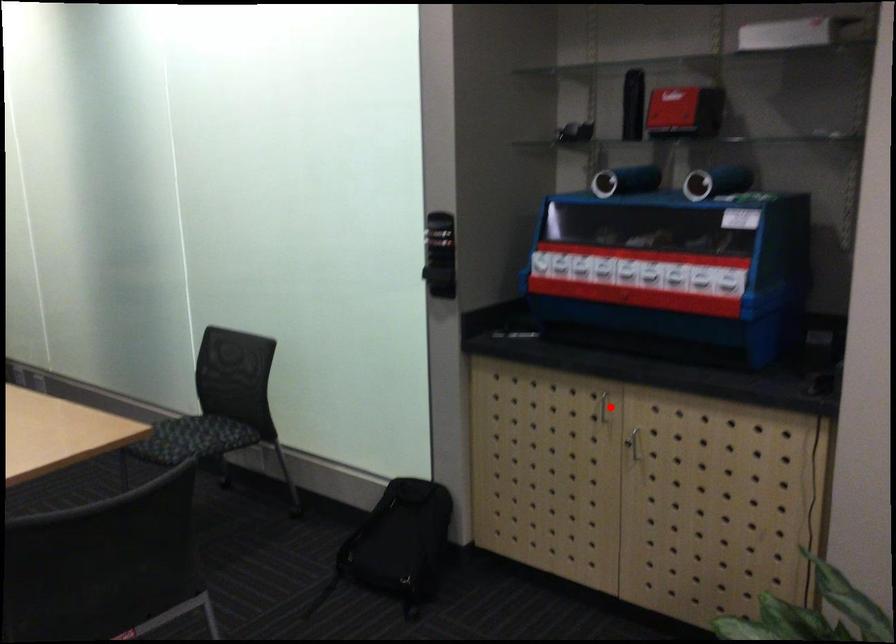
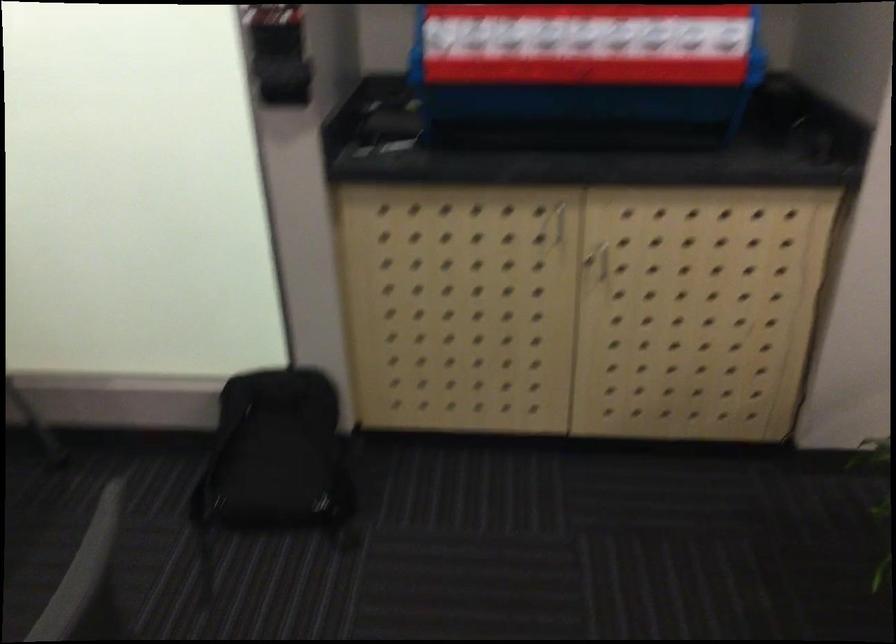
Question: I am providing you with two images of the same scene from different viewpoints. In image1, a red point is highlighted. Considering the same 3D point in image2, which of the following is correct?

Choices:
 (A) It is closer
 (B) It is farther

Answer: (A)